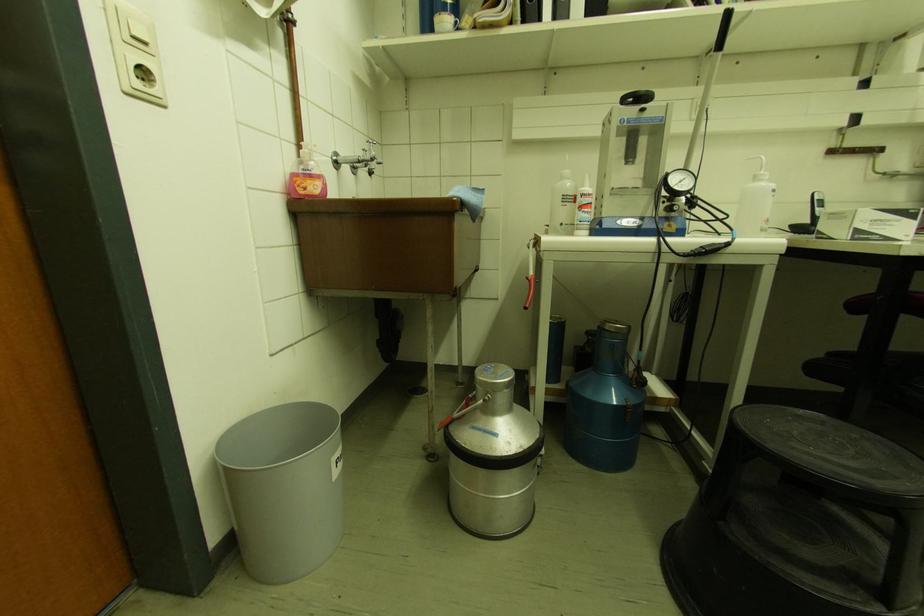
You are a GUI agent. You are given a task and a screenshot of the screen. Output one action in this format:
    pyautogui.click(x=<x>, y=<y>)
    Task: Click on the white squeeze bottle
    This screenshot has height=616, width=924.
    Given the screenshot: What is the action you would take?
    pyautogui.click(x=587, y=180)